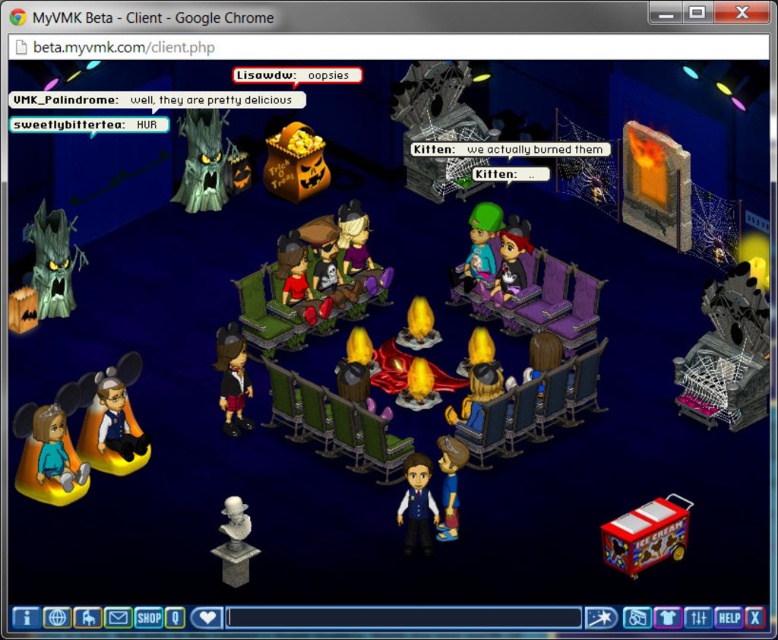
Question: Considering the relative positions of matte blue fabric toy at center and green matte plush toy at center in the image provided, where is matte blue fabric toy at center located with respect to green matte plush toy at center?

Choices:
 (A) below
 (B) above

Answer: (A)

Question: Which object is positioned closest to the orange plush toy at lower left?

Choices:
 (A) matte yellow plush toy at lower left
 (B) shiny blue toy at center
 (C) matte black plush at center

Answer: (A)

Question: Considering the real-world distances, which object is closest to the green plush couch at center?

Choices:
 (A) orange plush toy at lower left
 (B) green matte plush toy at center

Answer: (B)

Question: Is orange matte pumpkin bag at center behind matte blue fabric toy at center?

Choices:
 (A) yes
 (B) no

Answer: (A)

Question: Which object is positioned closest to the green matte tree at left?

Choices:
 (A) shiny blue toy at center
 (B) green plush couch at center

Answer: (B)

Question: Does green matte tree at left lie behind matte blue fabric toy at center?

Choices:
 (A) no
 (B) yes

Answer: (B)